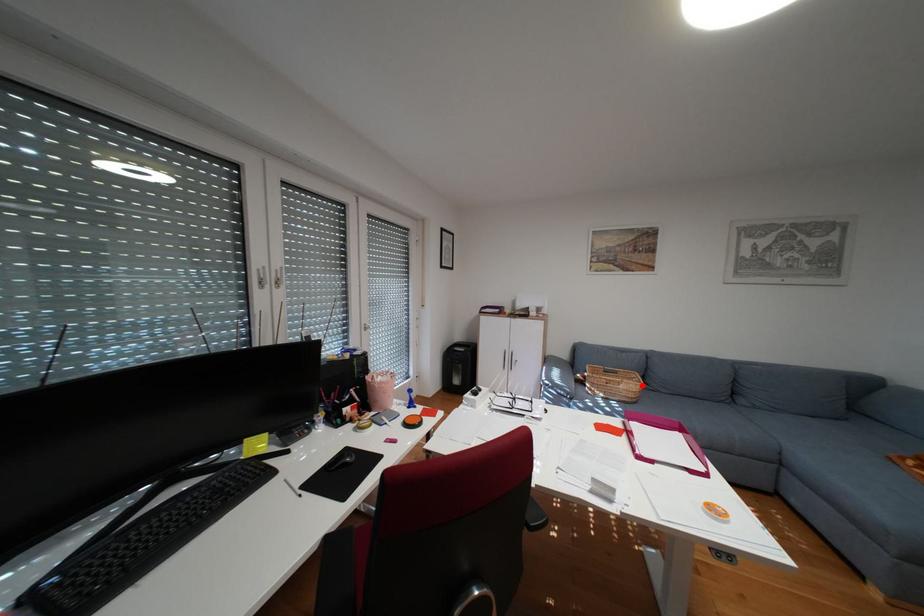
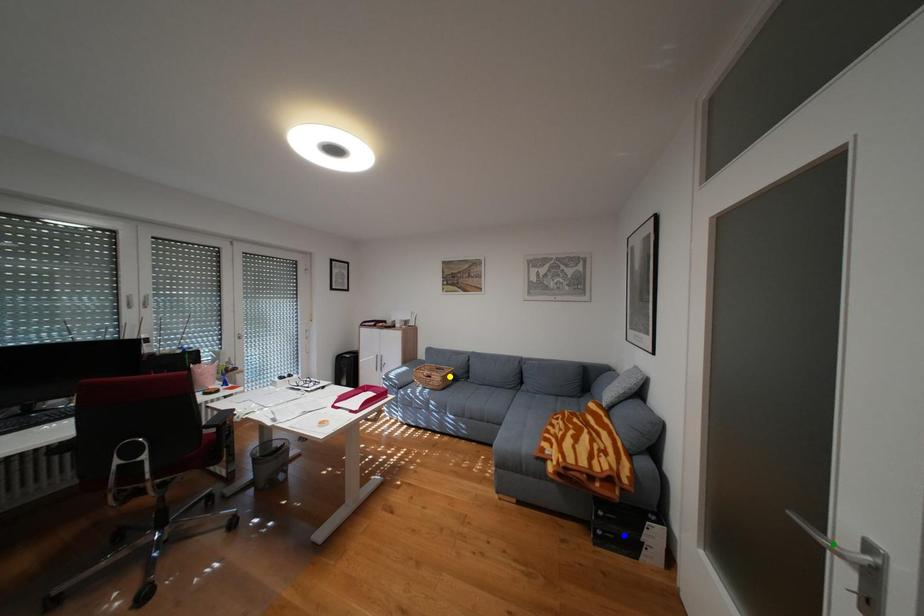
Question: I am providing you with two images of the same scene from different viewpoints. A red point is marked on the first image. You are given multiple points on the second image. Which mark in image 2 goes with the point in image 1?

Choices:
 (A) blue point
 (B) green point
 (C) yellow point

Answer: (C)